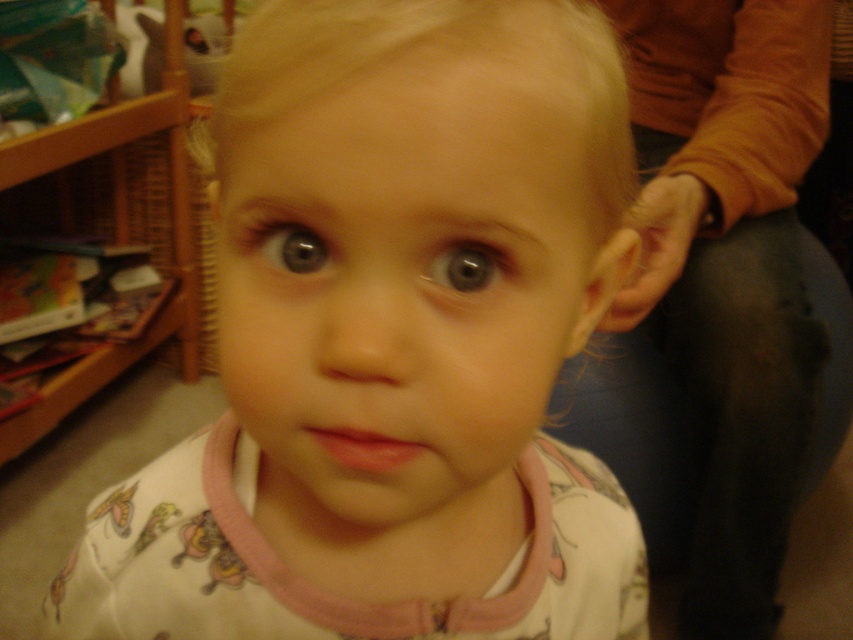
You are a photographer adjusting the lighting in the room. You need to ensure that the smooth skin face at center and the wooden bookshelf at left are both visible in the final photo. Which object should you focus on first to ensure proper exposure?

The smooth skin face at center is in front of the wooden bookshelf at left, so you should focus on the smooth skin face at center first to ensure proper exposure.

You are taking a photo of the scene and want to focus on both the point at (386, 253) and the point at (793, 144). Which point should you adjust your focus to first to ensure both are in focus?

You should focus on point (386, 253) first since it is closer to the camera and adjusting focus from closer to farther ensures both points can be in focus.